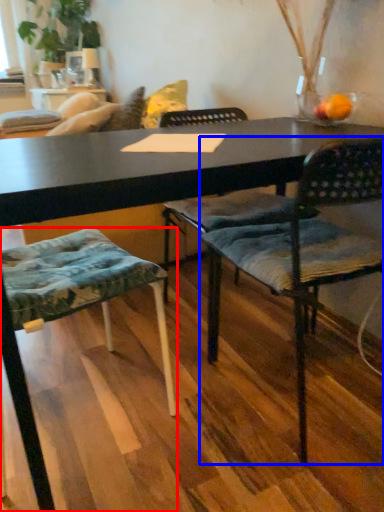
Question: Among these objects, which one is nearest to the camera, chair (highlighted by a red box) or chair (highlighted by a blue box)?

Choices:
 (A) chair
 (B) chair

Answer: (A)